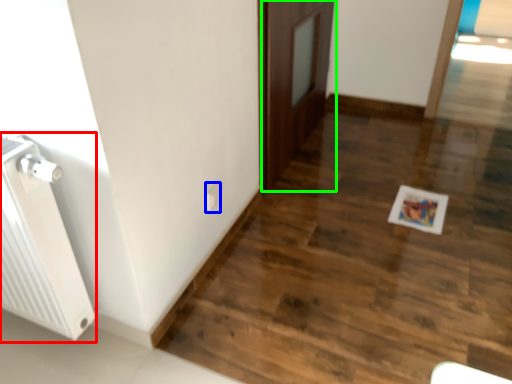
Question: Which object is positioned farthest from radiator (highlighted by a red box)? Select from electric outlet (highlighted by a blue box) and door (highlighted by a green box).

Choices:
 (A) electric outlet
 (B) door

Answer: (B)